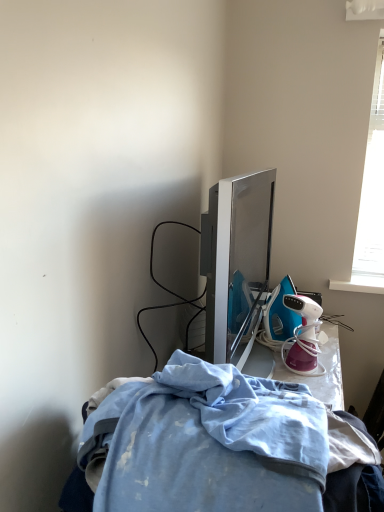
Question: From a real-world perspective, relative to light blue fabric at lower center, is pink glossy garment steamer at right vertically above or below?

Choices:
 (A) above
 (B) below

Answer: (B)

Question: Does point (301, 303) appear closer or farther from the camera than point (137, 388)?

Choices:
 (A) closer
 (B) farther

Answer: (B)

Question: Looking at the image, does pink glossy garment steamer at right seem bigger or smaller compared to light blue fabric at lower center?

Choices:
 (A) big
 (B) small

Answer: (B)

Question: Considering the positions of light blue fabric at lower center and pink glossy garment steamer at right in the image, is light blue fabric at lower center taller or shorter than pink glossy garment steamer at right?

Choices:
 (A) tall
 (B) short

Answer: (A)

Question: Based on their sizes in the image, would you say light blue fabric at lower center is bigger or smaller than pink glossy garment steamer at right?

Choices:
 (A) small
 (B) big

Answer: (B)

Question: From the image's perspective, is light blue fabric at lower center positioned above or below pink glossy garment steamer at right?

Choices:
 (A) below
 (B) above

Answer: (A)

Question: Relative to pink glossy garment steamer at right, is light blue fabric at lower center in front or behind?

Choices:
 (A) behind
 (B) front

Answer: (B)